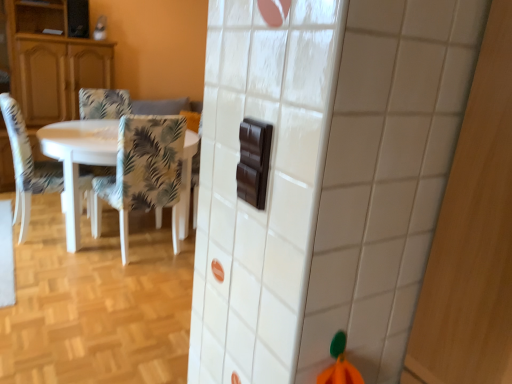
Describe the element at coordinates (27, 166) in the screenshot. I see `patterned fabric chair at left, which is the third chair in right-to-left order` at that location.

Describe the element at coordinates (142, 174) in the screenshot. This screenshot has width=512, height=384. I see `patterned fabric chair at left, acting as the first chair starting from the right` at that location.

Where is `floral fabric chair at left, the 2th chair in the right-to-left sequence`? floral fabric chair at left, the 2th chair in the right-to-left sequence is located at coordinates (103, 103).

Identify the location of patterned fabric chair at left, which is the third chair in right-to-left order. (27, 166).

Is patterned fabric chair at left, the third chair viewed from the left, bigger than white glossy table at left?

Actually, patterned fabric chair at left, the third chair viewed from the left, might be smaller than white glossy table at left.

From a real-world perspective, starting from the white glossy table at left, which chair is the 1st one vertically above it? Please provide its 2D coordinates.

[(142, 174)]

How many degrees apart are the facing directions of patterned fabric chair at left, acting as the first chair starting from the right, and white glossy table at left?

There is a 86.1-degree angle between the facing directions of patterned fabric chair at left, acting as the first chair starting from the right, and white glossy table at left.

From the picture: Based on their positions, is floral fabric chair at left, placed as the 2th chair when sorted from left to right, located to the left or right of matte wood cabinet at left?

From the image, it's evident that floral fabric chair at left, placed as the 2th chair when sorted from left to right, is to the right of matte wood cabinet at left.

From the picture: Is floral fabric chair at left, the 2th chair in the right-to-left sequence, located outside matte wood cabinet at left?

Absolutely, floral fabric chair at left, the 2th chair in the right-to-left sequence, is external to matte wood cabinet at left.

Is floral fabric chair at left, the 2th chair in the right-to-left sequence, placed right next to matte wood cabinet at left?

No, floral fabric chair at left, the 2th chair in the right-to-left sequence, is not beside matte wood cabinet at left.

From a real-world perspective, is floral fabric chair at left, the 2th chair in the right-to-left sequence, on matte wood cabinet at left?

Incorrect, from a real-world perspective, floral fabric chair at left, the 2th chair in the right-to-left sequence, is lower than matte wood cabinet at left.

Based on the photo, measure the distance from patterned fabric chair at left, acting as the first chair starting from the right, to floral fabric chair at left, the 2th chair in the right-to-left sequence.

They are 3.56 feet apart.

In the scene shown: Considering the relative sizes of patterned fabric chair at left, the third chair viewed from the left, and floral fabric chair at left, the 2th chair in the right-to-left sequence, in the image provided, is patterned fabric chair at left, the third chair viewed from the left, taller than floral fabric chair at left, the 2th chair in the right-to-left sequence,?

Yes, patterned fabric chair at left, the third chair viewed from the left, is taller than floral fabric chair at left, the 2th chair in the right-to-left sequence.

How many degrees apart are the facing directions of patterned fabric chair at left, acting as the first chair starting from the right, and floral fabric chair at left, placed as the 2th chair when sorted from left to right?

patterned fabric chair at left, acting as the first chair starting from the right, and floral fabric chair at left, placed as the 2th chair when sorted from left to right, are facing 170 degrees away from each other.

Could you tell me if patterned fabric chair at left, acting as the first chair starting from the right, is turned towards floral fabric chair at left, the 2th chair in the right-to-left sequence?

Yes, patterned fabric chair at left, acting as the first chair starting from the right, faces towards floral fabric chair at left, the 2th chair in the right-to-left sequence.

Is matte wood cabinet at left taller or shorter than floral fabric chair at left, the 2th chair in the right-to-left sequence?

In the image, matte wood cabinet at left appears to be taller than floral fabric chair at left, the 2th chair in the right-to-left sequence.

Is matte wood cabinet at left to the left or to the right of floral fabric chair at left, the 2th chair in the right-to-left sequence, in the image?

Clearly, matte wood cabinet at left is on the left of floral fabric chair at left, the 2th chair in the right-to-left sequence, in the image.

From the picture: From the image's perspective, which object appears higher, matte wood cabinet at left or floral fabric chair at left, the 2th chair in the right-to-left sequence?

matte wood cabinet at left appears higher in the image.

Image resolution: width=512 pixels, height=384 pixels. Find the location of `cabinetry above the patterned fabric chair at left, the third chair viewed from the left (from a real-world perspective)`. cabinetry above the patterned fabric chair at left, the third chair viewed from the left (from a real-world perspective) is located at coordinates (51, 62).

Does point (80, 76) lie in front of point (99, 204)?

No, (80, 76) is behind (99, 204).

Is there a large distance between matte wood cabinet at left and patterned fabric chair at left, acting as the first chair starting from the right?

That's right, there is a large distance between matte wood cabinet at left and patterned fabric chair at left, acting as the first chair starting from the right.

From the image's perspective, does patterned fabric chair at left, the 1th chair in the left-to-right sequence, appear lower than floral fabric chair at left, placed as the 2th chair when sorted from left to right?

Yes, from the image's perspective, patterned fabric chair at left, the 1th chair in the left-to-right sequence, is below floral fabric chair at left, placed as the 2th chair when sorted from left to right.

In the scene shown: From a real-world perspective, is patterned fabric chair at left, which is the third chair in right-to-left order, positioned over floral fabric chair at left, placed as the 2th chair when sorted from left to right, based on gravity?

Yes, from a real-world perspective, patterned fabric chair at left, which is the third chair in right-to-left order, is on top of floral fabric chair at left, placed as the 2th chair when sorted from left to right.

This screenshot has width=512, height=384. I want to click on chair above the patterned fabric chair at left, the 1th chair in the left-to-right sequence (from the image's perspective), so click(x=103, y=103).

Is patterned fabric chair at left, which is the third chair in right-to-left order, turned away from floral fabric chair at left, the 2th chair in the right-to-left sequence?

No, patterned fabric chair at left, which is the third chair in right-to-left order,'s orientation is not away from floral fabric chair at left, the 2th chair in the right-to-left sequence.

Does floral fabric chair at left, placed as the 2th chair when sorted from left to right, have a lesser height compared to white glossy table at left?

No.

Does floral fabric chair at left, placed as the 2th chair when sorted from left to right, turn towards white glossy table at left?

Yes, floral fabric chair at left, placed as the 2th chair when sorted from left to right, faces towards white glossy table at left.

Considering the relative sizes of floral fabric chair at left, the 2th chair in the right-to-left sequence, and white glossy table at left in the image provided, is floral fabric chair at left, the 2th chair in the right-to-left sequence, thinner than white glossy table at left?

Yes, floral fabric chair at left, the 2th chair in the right-to-left sequence, is thinner than white glossy table at left.

This screenshot has height=384, width=512. Identify the location of kitchen & dining room table that appears above the patterned fabric chair at left, acting as the first chair starting from the right (from the image's perspective). (83, 149).

Find the location of a particular element. The height and width of the screenshot is (384, 512). chair that is the 1st one when counting downward from the matte wood cabinet at left (from the image's perspective) is located at coordinates (103, 103).

Considering their positions, is matte wood cabinet at left positioned further to patterned fabric chair at left, acting as the first chair starting from the right, than floral fabric chair at left, the 2th chair in the right-to-left sequence?

matte wood cabinet at left.

Considering their positions, is patterned fabric chair at left, which is the third chair in right-to-left order, positioned closer to white glossy table at left than patterned fabric chair at left, the third chair viewed from the left?

The object closer to white glossy table at left is patterned fabric chair at left, the third chair viewed from the left.

When comparing their distances from floral fabric chair at left, placed as the 2th chair when sorted from left to right, does white glossy table at left or patterned fabric chair at left, which is the third chair in right-to-left order, seem closer?

white glossy table at left is closer to floral fabric chair at left, placed as the 2th chair when sorted from left to right.

Based on their spatial positions, is floral fabric chair at left, the 2th chair in the right-to-left sequence, or patterned fabric chair at left, which is the third chair in right-to-left order, further from white glossy table at left?

patterned fabric chair at left, which is the third chair in right-to-left order, is positioned further to the anchor white glossy table at left.

From the image, which object appears to be farther from patterned fabric chair at left, the 1th chair in the left-to-right sequence, patterned fabric chair at left, the third chair viewed from the left, or floral fabric chair at left, the 2th chair in the right-to-left sequence?

The object further to patterned fabric chair at left, the 1th chair in the left-to-right sequence, is floral fabric chair at left, the 2th chair in the right-to-left sequence.

Considering their positions, is white glossy table at left positioned closer to floral fabric chair at left, the 2th chair in the right-to-left sequence, than patterned fabric chair at left, acting as the first chair starting from the right?

white glossy table at left.

Considering their positions, is white glossy table at left positioned further to patterned fabric chair at left, which is the third chair in right-to-left order, than matte wood cabinet at left?

matte wood cabinet at left is further to patterned fabric chair at left, which is the third chair in right-to-left order.

Which object lies nearer to the anchor point matte wood cabinet at left, patterned fabric chair at left, which is the third chair in right-to-left order, or patterned fabric chair at left, the third chair viewed from the left?

patterned fabric chair at left, which is the third chair in right-to-left order.

This screenshot has height=384, width=512. I want to click on kitchen & dining room table located between matte wood cabinet at left and patterned fabric chair at left, acting as the first chair starting from the right, in the left-right direction, so click(x=83, y=149).

Identify the location of kitchen & dining room table situated between patterned fabric chair at left, the 1th chair in the left-to-right sequence, and patterned fabric chair at left, the third chair viewed from the left, from left to right. Image resolution: width=512 pixels, height=384 pixels. (83, 149).

This screenshot has height=384, width=512. In order to click on kitchen & dining room table located between patterned fabric chair at left, acting as the first chair starting from the right, and floral fabric chair at left, the 2th chair in the right-to-left sequence, in the depth direction in this screenshot , I will do `click(83, 149)`.

Find the location of `chair positioned between patterned fabric chair at left, the third chair viewed from the left, and floral fabric chair at left, placed as the 2th chair when sorted from left to right, from near to far`. chair positioned between patterned fabric chair at left, the third chair viewed from the left, and floral fabric chair at left, placed as the 2th chair when sorted from left to right, from near to far is located at coordinates (27, 166).